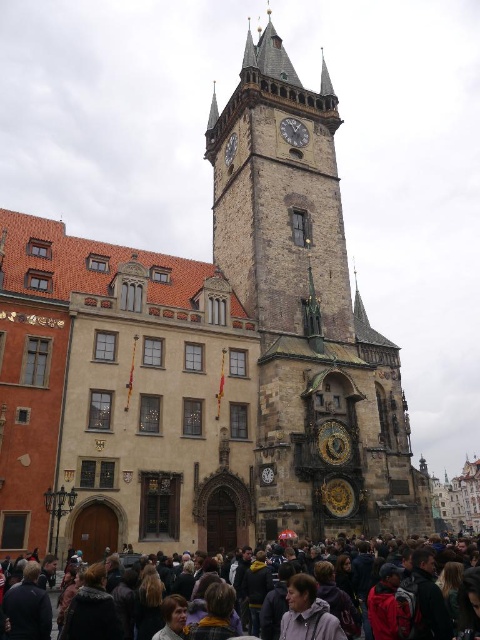
Can you confirm if dark gray clothing at lower center is smaller than dark gray stone clock at upper center?

Incorrect, dark gray clothing at lower center is not smaller in size than dark gray stone clock at upper center.

Can you confirm if dark gray clothing at lower center is positioned below dark gray stone clock at upper center?

Correct, dark gray clothing at lower center is located below dark gray stone clock at upper center.

Does point (439, 563) come farther from viewer compared to point (229, 156)?

That is False.

The height and width of the screenshot is (640, 480). Identify the location of dark gray clothing at lower center. (456, 552).

Does dark gray clothing at lower center have a greater height compared to dark gray metallic clock at center?

Yes.

Does dark gray clothing at lower center have a larger size compared to dark gray metallic clock at center?

Yes, dark gray clothing at lower center is bigger than dark gray metallic clock at center.

Between point (472, 624) and point (291, 125), which one is positioned in front?

Point (472, 624)

Locate an element on the screen. dark gray clothing at lower center is located at coordinates (456, 552).

Between dark gray metallic clock at center and dark gray stone clock at upper center, which one is positioned lower?

dark gray stone clock at upper center is lower down.

From the picture: Between dark gray metallic clock at center and dark gray stone clock at upper center, which one has less height?

With less height is dark gray metallic clock at center.

Does point (287, 122) come farther from viewer compared to point (229, 134)?

That is False.

Locate an element on the screen. The width and height of the screenshot is (480, 640). dark gray metallic clock at center is located at coordinates (294, 132).